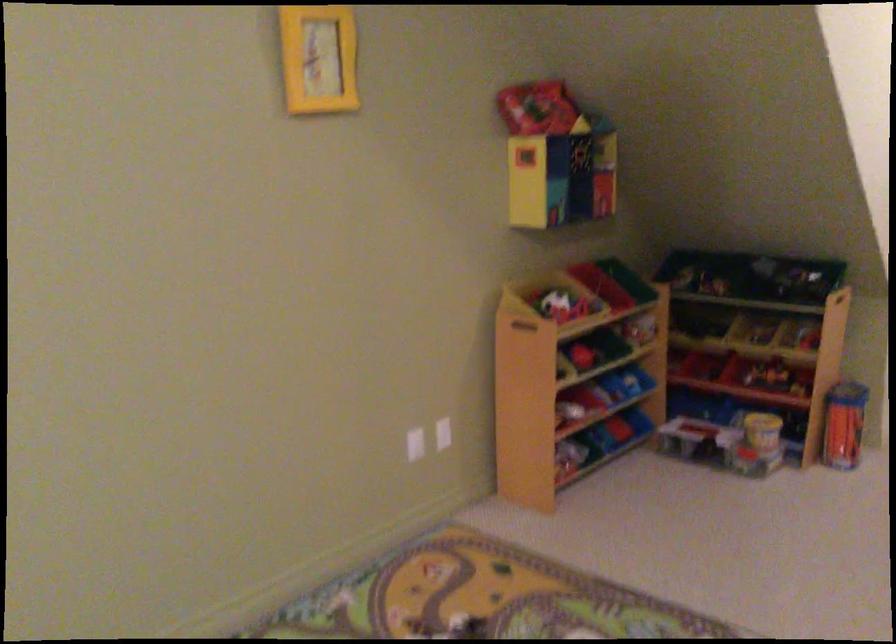
Find where to pull the green toy bin. Please return your answer as a coordinate pair (x, y).

(581, 178)